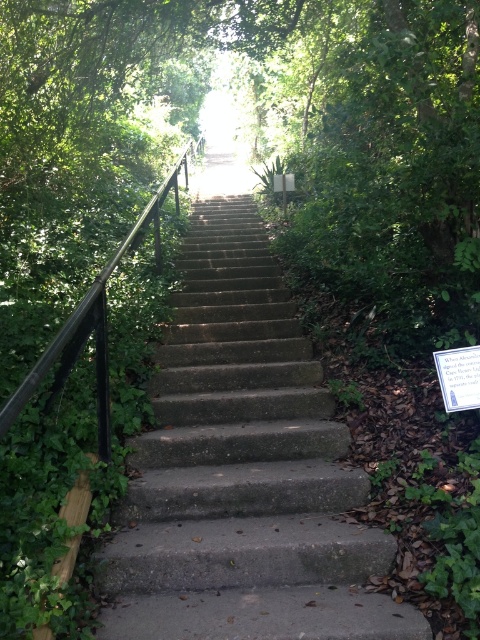
Is concrete stairs at center to the left of black metal/rail at upper center from the viewer's perspective?

Incorrect, concrete stairs at center is not on the left side of black metal/rail at upper center.

The height and width of the screenshot is (640, 480). What do you see at coordinates (242, 470) in the screenshot? I see `concrete stairs at center` at bounding box center [242, 470].

Locate an element on the screen. concrete stairs at center is located at coordinates (242, 470).